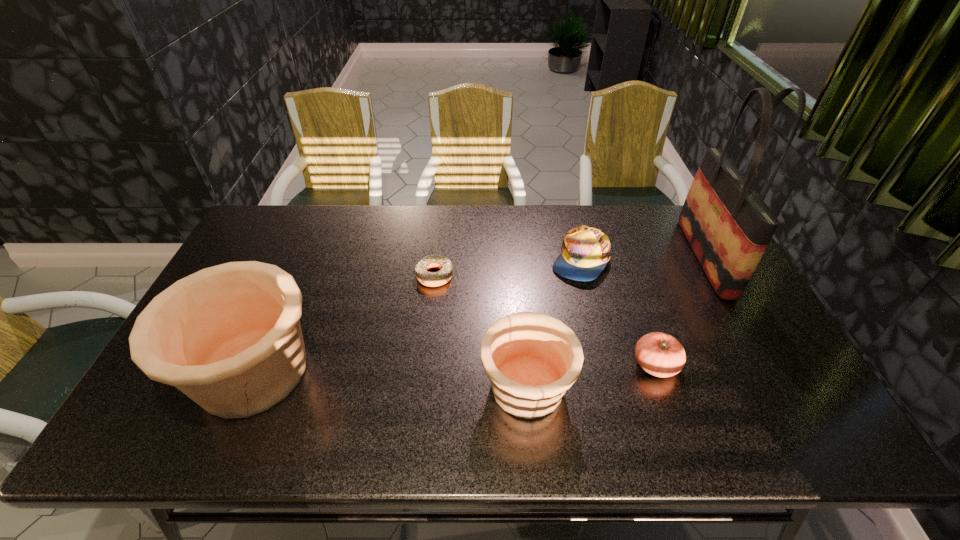
Locate an element on the screen. vacant space situated 0.110m on the back of the leftmost object is located at coordinates (288, 292).

Where is `vacant region located 0.320m on the back of the shorter pottery`? The height and width of the screenshot is (540, 960). vacant region located 0.320m on the back of the shorter pottery is located at coordinates (516, 267).

In order to click on vacant position located on the bill of the cap in this screenshot , I will do `click(599, 339)`.

You are a GUI agent. You are given a task and a screenshot of the screen. Output one action in this format:
    pyautogui.click(x=<x>, y=<y>)
    Task: Click on the free space located 0.290m on the front-facing side of the rightmost object
    
    Given the screenshot: What is the action you would take?
    pyautogui.click(x=599, y=257)

Find the location of a particular element. vacant region located 0.210m on the front-facing side of the rightmost object is located at coordinates (623, 257).

You are a GUI agent. You are given a task and a screenshot of the screen. Output one action in this format:
    pyautogui.click(x=<x>, y=<y>)
    Task: Click on the vacant space situated on the front-facing side of the rightmost object
    The image size is (960, 540).
    Given the screenshot: What is the action you would take?
    pyautogui.click(x=599, y=257)

Locate an element on the screen. This screenshot has width=960, height=540. vacant position located 0.150m on the right of the second object from left to right is located at coordinates (502, 275).

What are the coordinates of `free location located 0.270m on the right of the tomato` in the screenshot? It's located at (784, 364).

You are a GUI agent. You are given a task and a screenshot of the screen. Output one action in this format:
    pyautogui.click(x=<x>, y=<y>)
    Task: Click on the cap that is positioned at the far edge
    The height and width of the screenshot is (540, 960).
    Given the screenshot: What is the action you would take?
    pyautogui.click(x=585, y=251)

At what (x,y) coordinates should I click in order to perform the action: click on shopping bag that is at the far edge. Please return your answer as a coordinate pair (x, y). Looking at the image, I should click on (728, 225).